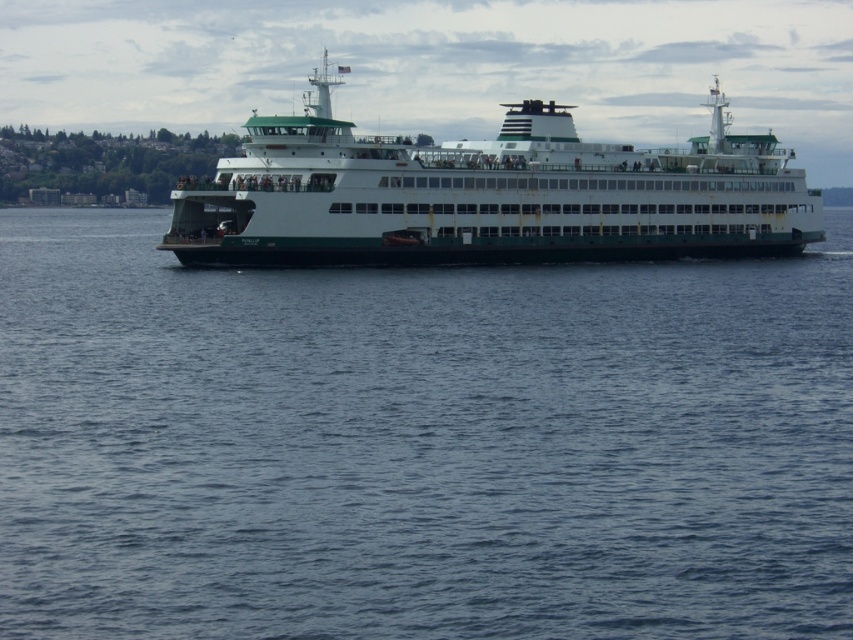
Does blue water at center appear on the left side of white matte ferry at center?

Correct, you'll find blue water at center to the left of white matte ferry at center.

Which is more to the right, blue water at center or white matte ferry at center?

white matte ferry at center

Does point (209, 625) come closer to viewer compared to point (730, 116)?

Yes, point (209, 625) is in front of point (730, 116).

Find the location of a particular element. The height and width of the screenshot is (640, 853). blue water at center is located at coordinates (419, 444).